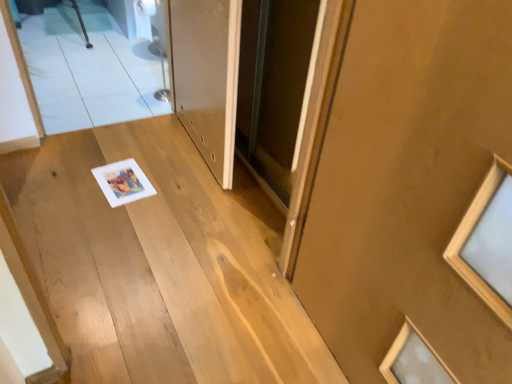
This screenshot has width=512, height=384. I want to click on free space on the front side of white glossy door at center, which is the 1th door from back to front, so click(172, 208).